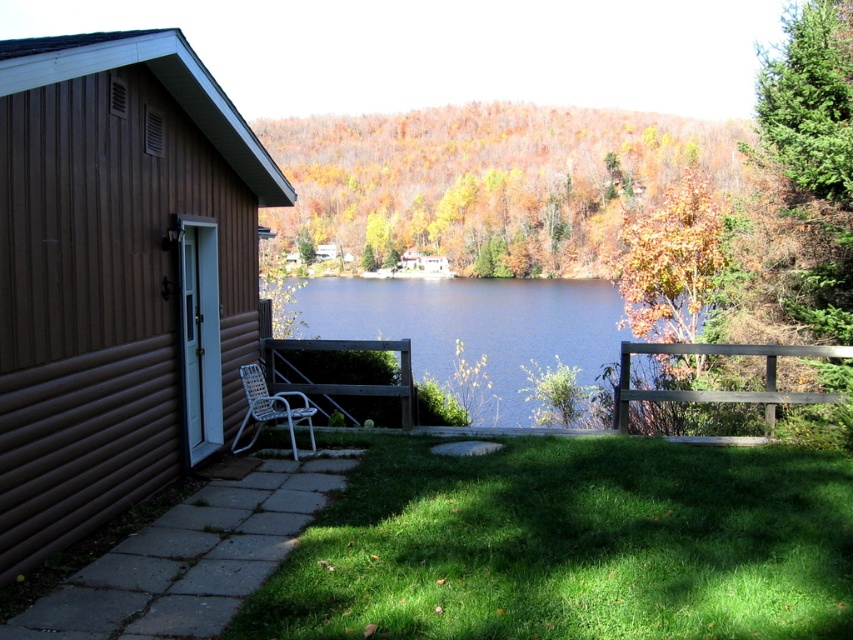
Is wooden park bench at center further to camera compared to white woven chair at lower left?

Yes.

Can you confirm if wooden park bench at center is positioned below white woven chair at lower left?

No, wooden park bench at center is not below white woven chair at lower left.

At what (x,y) coordinates should I click in order to perform the action: click on wooden park bench at center. Please return your answer as a coordinate pair (x, y). Looking at the image, I should click on click(347, 384).

You are a GUI agent. You are given a task and a screenshot of the screen. Output one action in this format:
    pyautogui.click(x=<x>, y=<y>)
    Task: Click on the wooden park bench at center
    The height and width of the screenshot is (640, 853).
    Given the screenshot: What is the action you would take?
    pyautogui.click(x=347, y=384)

Is brown wood cabin at left above brown wooden park bench at right?

Indeed, brown wood cabin at left is positioned over brown wooden park bench at right.

This screenshot has width=853, height=640. What are the coordinates of `brown wood cabin at left` in the screenshot? It's located at coord(109,269).

Identify the location of brown wood cabin at left. (109, 269).

Is point (32, 176) more distant than point (556, 321)?

That is False.

Does brown wood cabin at left have a lesser height compared to blue water at center?

Yes.

This screenshot has height=640, width=853. I want to click on brown wood cabin at left, so click(x=109, y=269).